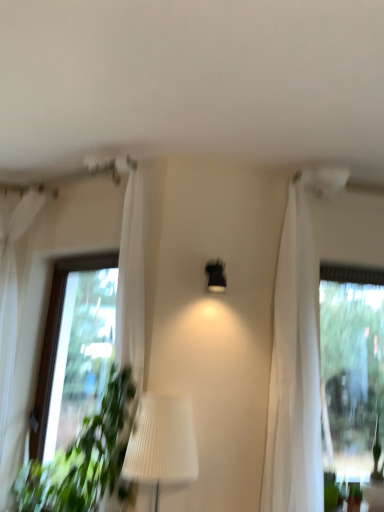
Question: Should I look upward or downward to see white sheer curtain at left?

Choices:
 (A) up
 (B) down

Answer: (B)

Question: Is matte black lamp at center to the left of white sheer curtain at left from the viewer's perspective?

Choices:
 (A) no
 (B) yes

Answer: (A)

Question: Is matte black lamp at center outside white sheer curtain at left?

Choices:
 (A) no
 (B) yes

Answer: (B)

Question: Can you confirm if matte black lamp at center is shorter than white sheer curtain at left?

Choices:
 (A) no
 (B) yes

Answer: (B)

Question: Can you confirm if matte black lamp at center is smaller than white sheer curtain at left?

Choices:
 (A) yes
 (B) no

Answer: (A)

Question: Would you say matte black lamp at center contains white sheer curtain at left?

Choices:
 (A) yes
 (B) no

Answer: (B)

Question: Is matte black lamp at center at the right side of white sheer curtain at left?

Choices:
 (A) no
 (B) yes

Answer: (B)

Question: Is white sheer curtain at left located outside matte black lamp at center?

Choices:
 (A) no
 (B) yes

Answer: (B)

Question: From a real-world perspective, is white sheer curtain at left positioned over matte black lamp at center based on gravity?

Choices:
 (A) yes
 (B) no

Answer: (B)

Question: Is white sheer curtain at left positioned behind matte black lamp at center?

Choices:
 (A) no
 (B) yes

Answer: (A)

Question: Does white sheer curtain at left have a greater height compared to matte black lamp at center?

Choices:
 (A) no
 (B) yes

Answer: (B)

Question: Is white sheer curtain at left positioned with its back to matte black lamp at center?

Choices:
 (A) yes
 (B) no

Answer: (B)

Question: Considering the relative sizes of white sheer curtain at left and matte black lamp at center in the image provided, is white sheer curtain at left thinner than matte black lamp at center?

Choices:
 (A) no
 (B) yes

Answer: (A)

Question: In terms of height, does matte black lamp at center look taller or shorter compared to white sheer curtain at left?

Choices:
 (A) short
 (B) tall

Answer: (A)